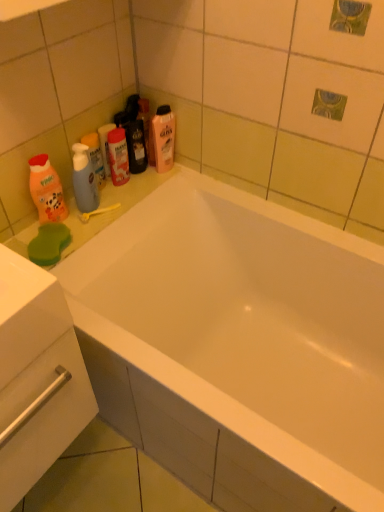
Question: Can you confirm if orange matte bottle at left, which is the 1th cleaning product in bottom-to-top order, is bigger than white glossy drawer at lower left?

Choices:
 (A) no
 (B) yes

Answer: (A)

Question: Is orange matte bottle at left, the 2th cleaning product from the top, at the right side of white glossy drawer at lower left?

Choices:
 (A) no
 (B) yes

Answer: (A)

Question: Is orange matte bottle at left, placed as the 1th cleaning product when sorted from left to right, positioned with its back to white glossy drawer at lower left?

Choices:
 (A) no
 (B) yes

Answer: (A)

Question: Does orange matte bottle at left, which is the 1th cleaning product in bottom-to-top order, have a greater height compared to white glossy drawer at lower left?

Choices:
 (A) yes
 (B) no

Answer: (B)

Question: From a real-world perspective, is orange matte bottle at left, positioned as the first cleaning product in front-to-back order, located higher than white glossy drawer at lower left?

Choices:
 (A) no
 (B) yes

Answer: (B)

Question: Is orange matte bottle at left, the 2th cleaning product from the top, closer to the viewer compared to white glossy drawer at lower left?

Choices:
 (A) yes
 (B) no

Answer: (B)

Question: Is white glossy drawer at lower left smaller than white glossy bathtub at center?

Choices:
 (A) no
 (B) yes

Answer: (B)

Question: Considering the relative sizes of white glossy drawer at lower left and white glossy bathtub at center in the image provided, is white glossy drawer at lower left wider than white glossy bathtub at center?

Choices:
 (A) no
 (B) yes

Answer: (A)

Question: Is white glossy bathtub at center a part of white glossy drawer at lower left?

Choices:
 (A) yes
 (B) no

Answer: (B)

Question: Can you confirm if white glossy drawer at lower left is positioned to the left of white glossy bathtub at center?

Choices:
 (A) yes
 (B) no

Answer: (A)

Question: From a real-world perspective, is white glossy drawer at lower left positioned over white glossy bathtub at center based on gravity?

Choices:
 (A) no
 (B) yes

Answer: (B)

Question: Is white glossy drawer at lower left positioned far away from white glossy bathtub at center?

Choices:
 (A) no
 (B) yes

Answer: (A)

Question: Is orange matte bottle at left, the 2th cleaning product when ordered from right to left, not near translucent plastic mouthwash at upper center, marked as the first mouthwash in a right-to-left arrangement?

Choices:
 (A) yes
 (B) no

Answer: (B)